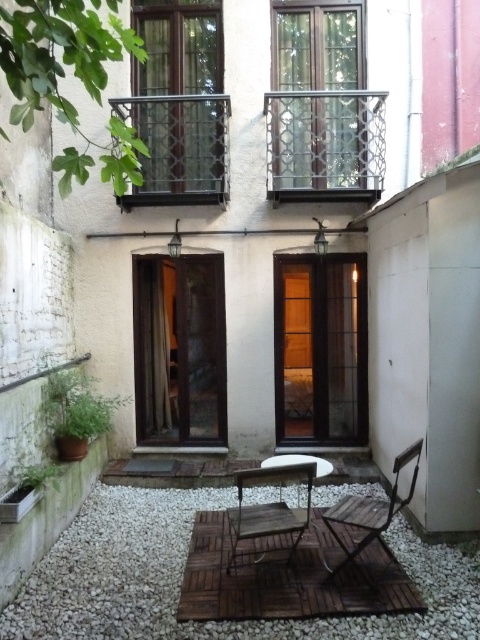
Is the position of white gravel at center less distant than that of wooden chair at center?

Yes, white gravel at center is closer to the viewer.

Can you confirm if white gravel at center is smaller than wooden chair at center?

No, white gravel at center is not smaller than wooden chair at center.

You are a GUI agent. You are given a task and a screenshot of the screen. Output one action in this format:
    pyautogui.click(x=<x>, y=<y>)
    Task: Click on the white gravel at center
    This screenshot has height=640, width=480.
    Given the screenshot: What is the action you would take?
    (x=182, y=573)

Does point (397, 460) lie behind point (277, 465)?

No, (397, 460) is closer to viewer.

Is wooden chair at lower right taller than wooden table at center?

Indeed, wooden chair at lower right has a greater height compared to wooden table at center.

Image resolution: width=480 pixels, height=640 pixels. I want to click on wooden chair at lower right, so click(x=370, y=513).

What do you see at coordinates (268, 508) in the screenshot?
I see `wooden chair at center` at bounding box center [268, 508].

Can you confirm if wooden chair at center is positioned to the right of wooden table at center?

No, wooden chair at center is not to the right of wooden table at center.

This screenshot has height=640, width=480. I want to click on wooden chair at center, so click(268, 508).

Where is `wooden chair at center`? The image size is (480, 640). wooden chair at center is located at coordinates (268, 508).